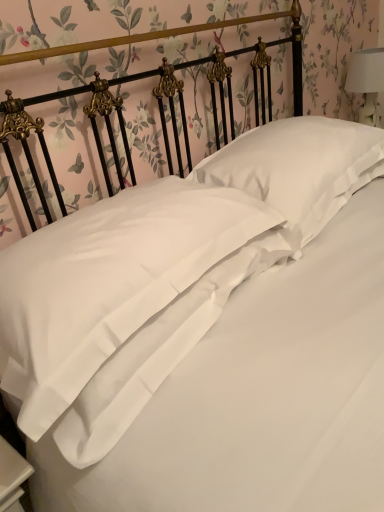
Question: From a real-world perspective, does white satin pillow at center, the 2th pillow positioned from the left, stand above satin white pillow at center, which is counted as the 1th pillow, starting from the left?

Choices:
 (A) yes
 (B) no

Answer: (A)

Question: From a real-world perspective, is white satin pillow at center, which is the first pillow in right-to-left order, positioned under satin white pillow at center, marked as the second pillow in a right-to-left arrangement, based on gravity?

Choices:
 (A) no
 (B) yes

Answer: (A)

Question: Does white satin pillow at center, which is the first pillow in right-to-left order, have a greater height compared to satin white pillow at center, marked as the second pillow in a right-to-left arrangement?

Choices:
 (A) yes
 (B) no

Answer: (A)

Question: Does white satin pillow at center, the 2th pillow positioned from the left, touch satin white pillow at center, which is counted as the 1th pillow, starting from the left?

Choices:
 (A) no
 (B) yes

Answer: (A)

Question: Is white satin pillow at center, the 2th pillow positioned from the left, smaller than satin white pillow at center, which is counted as the 1th pillow, starting from the left?

Choices:
 (A) no
 (B) yes

Answer: (B)

Question: Looking at the image, does white fabric lampshade at upper right seem bigger or smaller compared to white satin pillow at center, the 2th pillow positioned from the left?

Choices:
 (A) small
 (B) big

Answer: (A)

Question: Relative to white satin pillow at center, the 2th pillow positioned from the left, is white fabric lampshade at upper right in front or behind?

Choices:
 (A) behind
 (B) front

Answer: (A)

Question: From the image's perspective, is white fabric lampshade at upper right positioned above or below white satin pillow at center, the 2th pillow positioned from the left?

Choices:
 (A) above
 (B) below

Answer: (A)

Question: Looking at their shapes, would you say white fabric lampshade at upper right is wider or thinner than white satin pillow at center, which is the first pillow in right-to-left order?

Choices:
 (A) wide
 (B) thin

Answer: (B)

Question: Is white fabric lampshade at upper right inside or outside of satin white pillow at center, marked as the second pillow in a right-to-left arrangement?

Choices:
 (A) outside
 (B) inside

Answer: (A)

Question: From a real-world perspective, relative to satin white pillow at center, which is counted as the 1th pillow, starting from the left, is white fabric lampshade at upper right vertically above or below?

Choices:
 (A) above
 (B) below

Answer: (A)

Question: From the image's perspective, is white fabric lampshade at upper right positioned above or below satin white pillow at center, which is counted as the 1th pillow, starting from the left?

Choices:
 (A) above
 (B) below

Answer: (A)

Question: Looking at their shapes, would you say white fabric lampshade at upper right is wider or thinner than satin white pillow at center, marked as the second pillow in a right-to-left arrangement?

Choices:
 (A) thin
 (B) wide

Answer: (A)

Question: Visually, is white satin pillow at center, the 2th pillow positioned from the left, positioned to the left or to the right of white fabric lampshade at upper right?

Choices:
 (A) left
 (B) right

Answer: (A)

Question: Choose the correct answer: Is white satin pillow at center, which is the first pillow in right-to-left order, inside white fabric lampshade at upper right or outside it?

Choices:
 (A) outside
 (B) inside

Answer: (A)